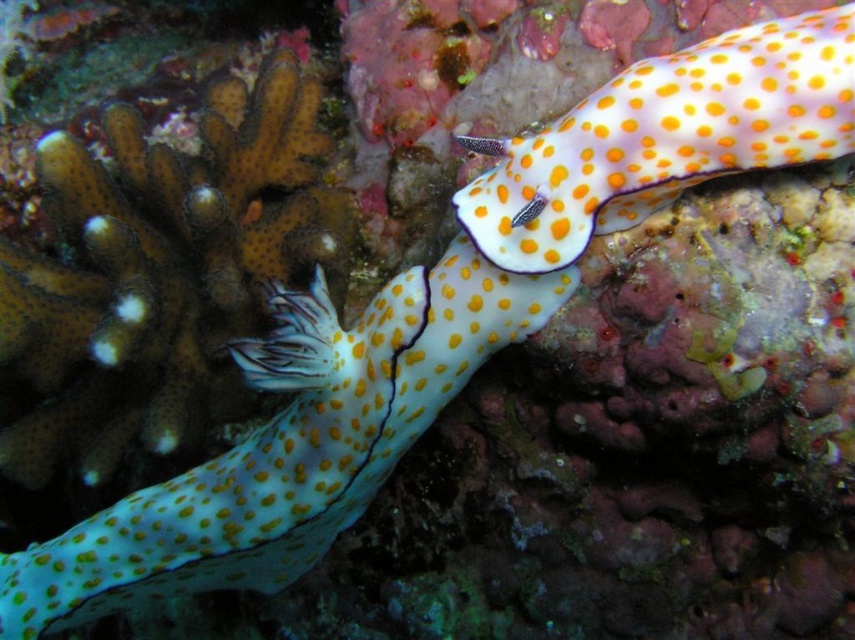
Question: Observing the image, what is the correct spatial positioning of translucent yellow spotted sea slug at center in reference to orange dotted shell at upper right?

Choices:
 (A) above
 (B) below

Answer: (B)

Question: Observing the image, what is the correct spatial positioning of translucent yellow spotted sea slug at center in reference to orange dotted shell at upper right?

Choices:
 (A) left
 (B) right

Answer: (A)

Question: Does translucent yellow spotted sea slug at center appear over orange dotted shell at upper right?

Choices:
 (A) no
 (B) yes

Answer: (A)

Question: Which point is farther from the camera taking this photo?

Choices:
 (A) (433, 308)
 (B) (475, 227)

Answer: (A)